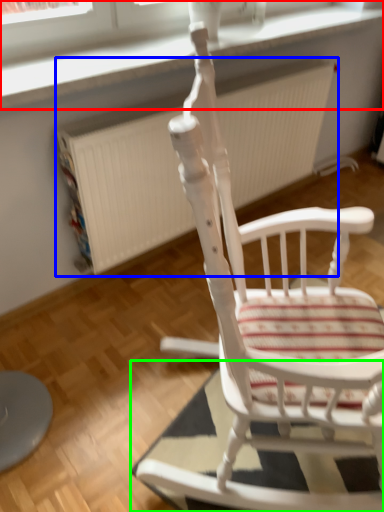
Question: Which object is positioned farthest from window frame (highlighted by a red box)? Select from radiator (highlighted by a blue box) and mat (highlighted by a green box).

Choices:
 (A) radiator
 (B) mat

Answer: (B)